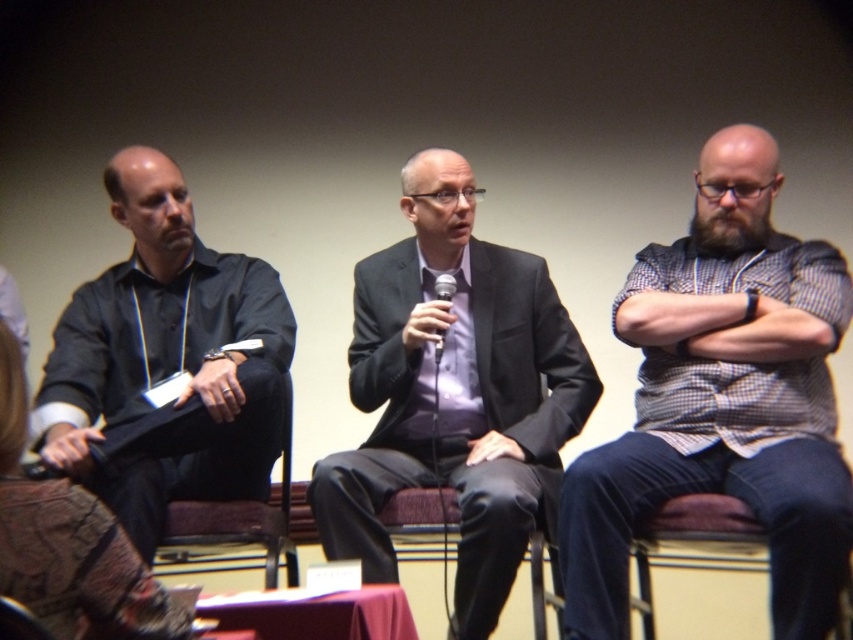
You are a photographer positioned behind the stage. You need to capture a closeup of the black matte shirt at left and the brown fabric chair at lower left in the same frame. What is the minimum distance you need to move forward to ensure both are in focus?

The black matte shirt at left is 26.54 centimeters away from the brown fabric chair at lower left. To ensure both are in focus, you need to move forward until the distance between them is within your camera lens depth of field. However, without knowing the exact depth of field, the minimum distance to move forward would depend on adjusting focus to the midpoint between the two objects, approximately 13.27 centimeters from each.

You are an event organizer who needs to arrange the seating for the next panel discussion. The venue requires that the speaker in the matte black suit at center must be seated to the right of the person in the black matte shirt at left. Is this arrangement possible based on their current positions?

The matte black suit at center is positioned under the black matte shirt at left, meaning they are not aligned horizontally. Therefore, moving the matte black suit at center to the right of the black matte shirt at left is possible as they can be repositioned horizontally.